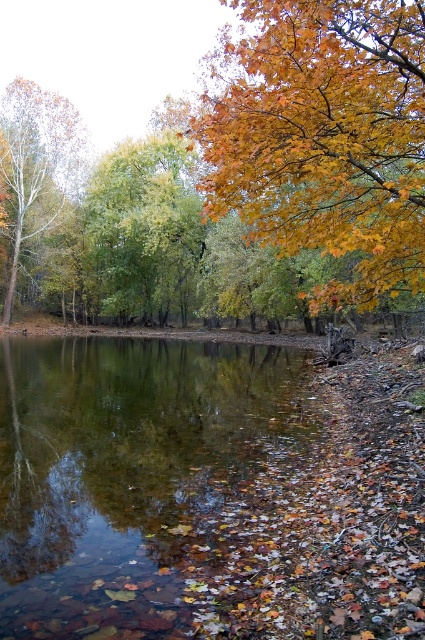
You are standing at the edge of the water in the autumn scene. There is a point marked at coordinates point (x=146, y=483). What is the significance of this point in the scene?

The point (x=146, y=483) represents the location of clear water at center in the scene.

You are standing at the edge of the water and want to throw a pebble into the clear water at center so that it reaches the green leafy tree at center. Is this possible?

The clear water at center is closer to the viewer than the green leafy tree at center, so the pebble cannot reach the green leafy tree at center because it is farther away.

You are standing at the edge of the water in the serene autumnal scene. There are two points marked in the image. Which point, point (300, 116) or point (183, 230), is closer to you?

Point (300, 116) is closer to the viewer than point (183, 230).